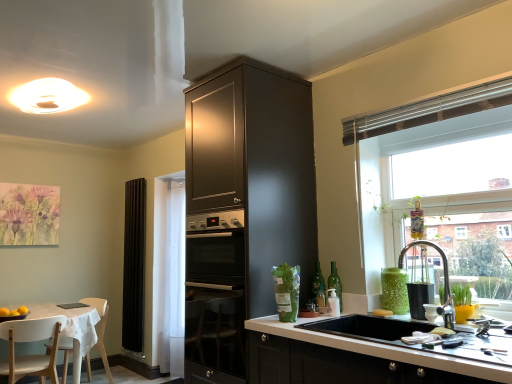
Question: Is white wood chair at lower left, which is the 2th chair from back to front, not inside white glossy vase at lower right?

Choices:
 (A) no
 (B) yes

Answer: (B)

Question: Considering the relative positions of white wood chair at lower left, which is the 2th chair from back to front, and white glossy vase at lower right in the image provided, is white wood chair at lower left, which is the 2th chair from back to front, in front of white glossy vase at lower right?

Choices:
 (A) yes
 (B) no

Answer: (B)

Question: Is white wood chair at lower left, which is the first chair from front to back, positioned far away from white glossy vase at lower right?

Choices:
 (A) yes
 (B) no

Answer: (A)

Question: Does white wood chair at lower left, which is the 2th chair from back to front, appear on the right side of white glossy vase at lower right?

Choices:
 (A) yes
 (B) no

Answer: (B)

Question: Can you confirm if white wood chair at lower left, which is the 2th chair from back to front, is shorter than white glossy vase at lower right?

Choices:
 (A) yes
 (B) no

Answer: (B)

Question: Considering the relative sizes of white wood chair at lower left, which is the 2th chair from back to front, and white glossy vase at lower right in the image provided, is white wood chair at lower left, which is the 2th chair from back to front, wider than white glossy vase at lower right?

Choices:
 (A) no
 (B) yes

Answer: (B)

Question: From the image's perspective, is white plastic chair at lower left, acting as the 1th chair starting from the back, below white wood chair at lower left, which is the first chair from front to back?

Choices:
 (A) yes
 (B) no

Answer: (A)

Question: Does white plastic chair at lower left, the 2th chair in the front-to-back sequence, touch white wood chair at lower left, which is the first chair from front to back?

Choices:
 (A) no
 (B) yes

Answer: (A)

Question: Is white plastic chair at lower left, the 2th chair in the front-to-back sequence, positioned before white wood chair at lower left, which is the 2th chair from back to front?

Choices:
 (A) yes
 (B) no

Answer: (B)

Question: Is white plastic chair at lower left, acting as the 1th chair starting from the back, facing towards white wood chair at lower left, which is the first chair from front to back?

Choices:
 (A) yes
 (B) no

Answer: (B)

Question: Is white plastic chair at lower left, the 2th chair in the front-to-back sequence, facing away from white wood chair at lower left, which is the 2th chair from back to front?

Choices:
 (A) no
 (B) yes

Answer: (A)

Question: Does white plastic chair at lower left, acting as the 1th chair starting from the back, have a larger size compared to white wood chair at lower left, which is the 2th chair from back to front?

Choices:
 (A) no
 (B) yes

Answer: (B)

Question: From the image's perspective, is yellow matte soap at sink above white glossy vase at lower right?

Choices:
 (A) no
 (B) yes

Answer: (A)